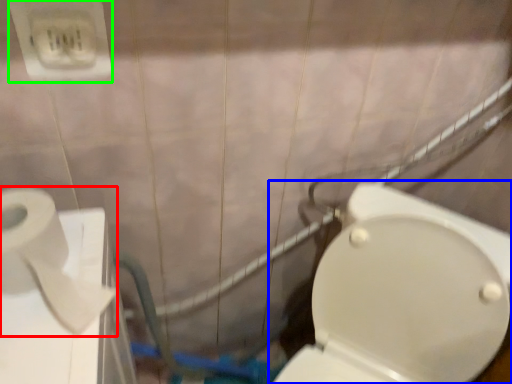
Question: Considering the real-world distances, which object is farthest from toilet paper (highlighted by a red box)? toilet (highlighted by a blue box) or electric outlet (highlighted by a green box)?

Choices:
 (A) toilet
 (B) electric outlet

Answer: (A)